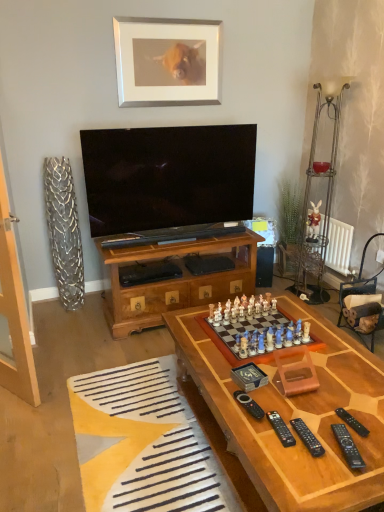
Locate an element on the screen. The height and width of the screenshot is (512, 384). free space to the left of black plastic remote at lower right, which appears as the 5th remote when viewed from the left is located at coordinates (304, 420).